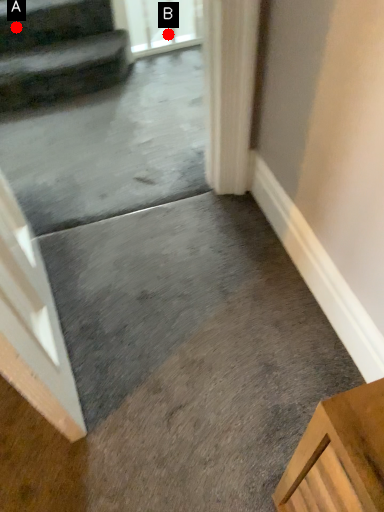
Question: Two points are circled on the image, labeled by A and B beside each circle. Which point appears farthest from the camera in this image?

Choices:
 (A) A is further
 (B) B is further

Answer: (B)